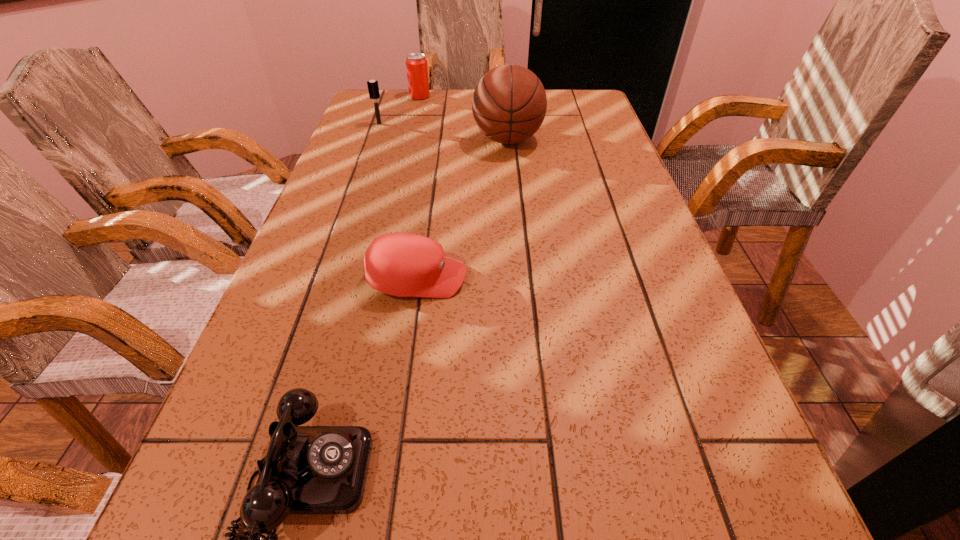
Locate an element on the screen. This screenshot has width=960, height=540. blank area located 0.370m on the front-facing side of the second nearest object is located at coordinates pyautogui.click(x=648, y=279).

This screenshot has height=540, width=960. Find the location of `object that is at the far edge`. object that is at the far edge is located at coordinates (416, 64).

Where is `can that is at the left edge`? can that is at the left edge is located at coordinates (416, 64).

This screenshot has width=960, height=540. I want to click on hairbrush located in the left edge section of the desktop, so click(373, 87).

The width and height of the screenshot is (960, 540). What are the coordinates of `object that is positioned at the far left corner` in the screenshot? It's located at (416, 64).

I want to click on vacant space at the far edge of the desktop, so click(454, 95).

The width and height of the screenshot is (960, 540). Identify the location of vacant region at the left edge. [349, 265].

Image resolution: width=960 pixels, height=540 pixels. Identify the location of vacant area at the right edge. (567, 143).

This screenshot has height=540, width=960. What are the coordinates of `free region at the far left corner` in the screenshot? It's located at (353, 118).

Where is `empty space between the cap and the can`? empty space between the cap and the can is located at coordinates (419, 187).